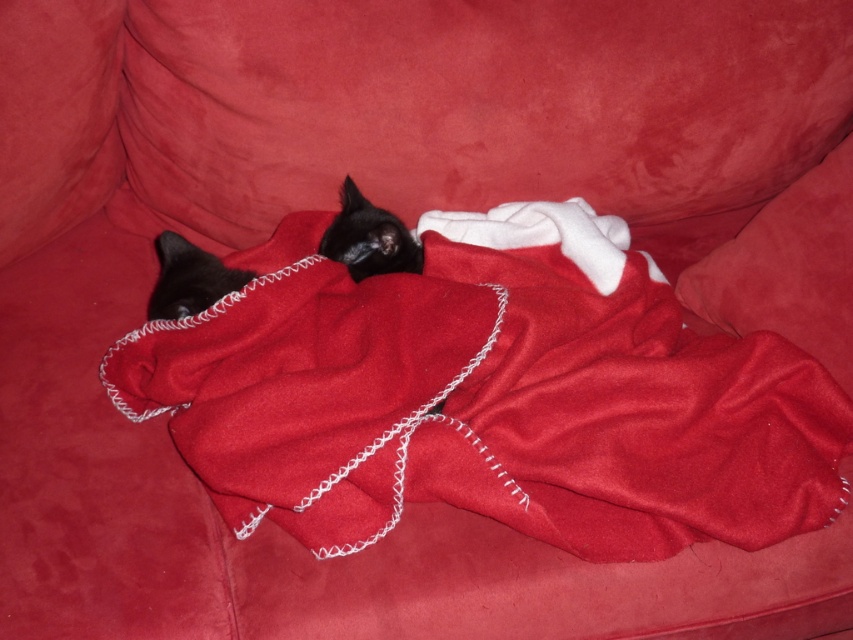
Question: Which point is farther to the camera?

Choices:
 (A) (204, 292)
 (B) (808, 332)
 (C) (351, 209)

Answer: (C)

Question: Is velvet cushion at center positioned in front of matte black cat at left?

Choices:
 (A) no
 (B) yes

Answer: (B)

Question: Which point is closer to the camera taking this photo?

Choices:
 (A) (817, 204)
 (B) (372, 248)

Answer: (A)

Question: Can you confirm if velvet cushion at center is positioned to the right of matte black cat at left?

Choices:
 (A) no
 (B) yes

Answer: (B)

Question: Is velvet cushion at center positioned at the back of matte black cat at left?

Choices:
 (A) no
 (B) yes

Answer: (A)

Question: Which point appears farthest from the camera in this image?

Choices:
 (A) (355, 259)
 (B) (227, 285)
 (C) (840, 330)

Answer: (A)